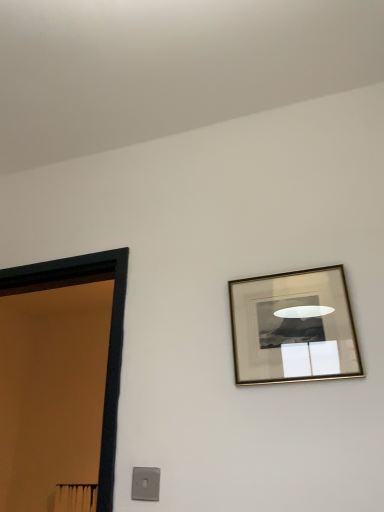
Question: From the image's perspective, relative to satin silver switch at lower left, is gold metallic picture frame at upper right above or below?

Choices:
 (A) above
 (B) below

Answer: (A)

Question: Looking at their shapes, would you say gold metallic picture frame at upper right is wider or thinner than satin silver switch at lower left?

Choices:
 (A) thin
 (B) wide

Answer: (B)

Question: Which of these objects is positioned closest to the satin silver switch at lower left?

Choices:
 (A) black wooden door at left
 (B) gold metallic picture frame at upper right

Answer: (A)

Question: Which is farther from the satin silver switch at lower left?

Choices:
 (A) gold metallic picture frame at upper right
 (B) black wooden door at left

Answer: (A)